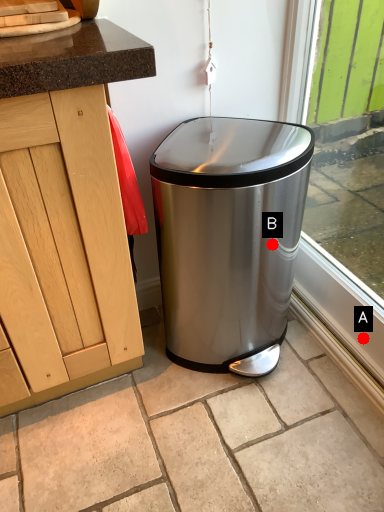
Question: Two points are circled on the image, labeled by A and B beside each circle. Which point is further to the camera?

Choices:
 (A) A is further
 (B) B is further

Answer: (B)